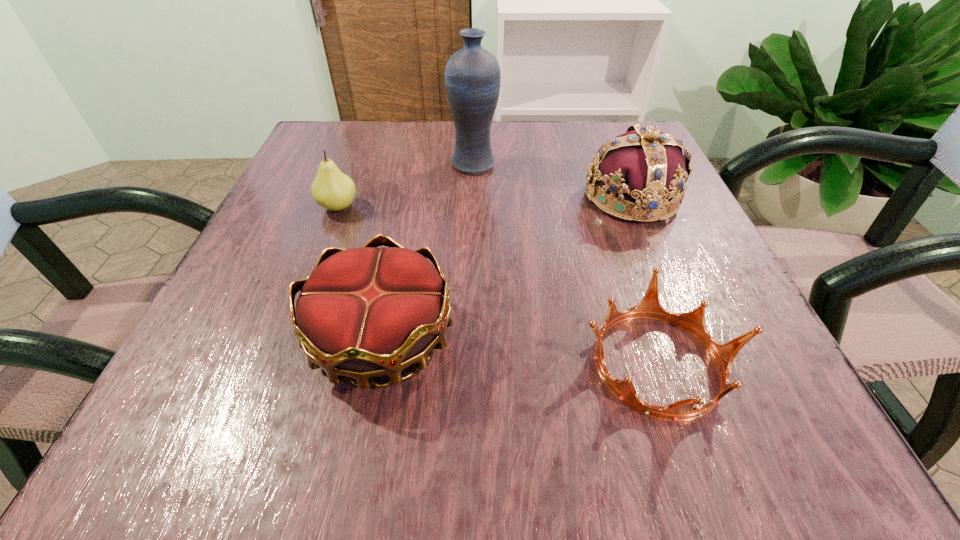
This screenshot has width=960, height=540. I want to click on the tallest object, so click(x=472, y=76).

Locate an element on the screen. This screenshot has width=960, height=540. the farthest crown is located at coordinates (644, 165).

Where is `the tallest crown`? the tallest crown is located at coordinates (644, 165).

Identify the location of pear. (333, 190).

In order to click on the second tallest crown in this screenshot , I will do `click(366, 312)`.

You are a GUI agent. You are given a task and a screenshot of the screen. Output one action in this format:
    pyautogui.click(x=<x>, y=<y>)
    Task: Click on the shortest object
    The image size is (960, 540).
    Given the screenshot: What is the action you would take?
    pyautogui.click(x=693, y=322)

Locate an element on the screen. The image size is (960, 540). blank space located 0.060m on the right of the tallest object is located at coordinates (527, 164).

Locate an element on the screen. vacant space positioned 0.120m on the back of the farthest crown is located at coordinates (608, 141).

Identify the location of vacant space located on the right of the pear. (578, 207).

Identify the location of free location located on the right of the leftmost crown. coord(565,338).